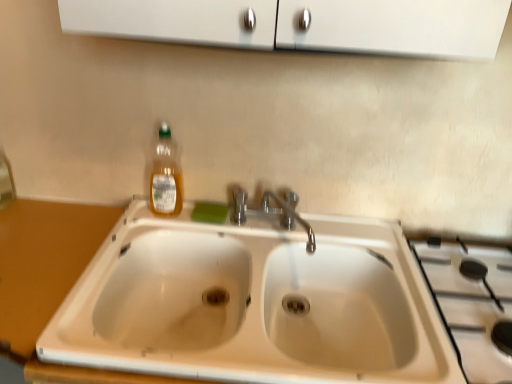
Question: Considering the positions of white ceramic gas stove at right and white ceramic sink at center in the image, is white ceramic gas stove at right bigger or smaller than white ceramic sink at center?

Choices:
 (A) big
 (B) small

Answer: (B)

Question: Considering the positions of white ceramic gas stove at right and white ceramic sink at center in the image, is white ceramic gas stove at right taller or shorter than white ceramic sink at center?

Choices:
 (A) short
 (B) tall

Answer: (A)

Question: Estimate the real-world distances between objects in this image. Which object is farther from the wooden counter at lower left?

Choices:
 (A) white ceramic sink at center
 (B) white ceramic gas stove at right
 (C) green sponge at sink
 (D) translucent plastic bottle at upper left

Answer: (B)

Question: Considering the real-world distances, which object is farthest from the translucent plastic bottle at upper left?

Choices:
 (A) white ceramic sink at center
 (B) white ceramic gas stove at right
 (C) wooden counter at lower left
 (D) green sponge at sink

Answer: (B)